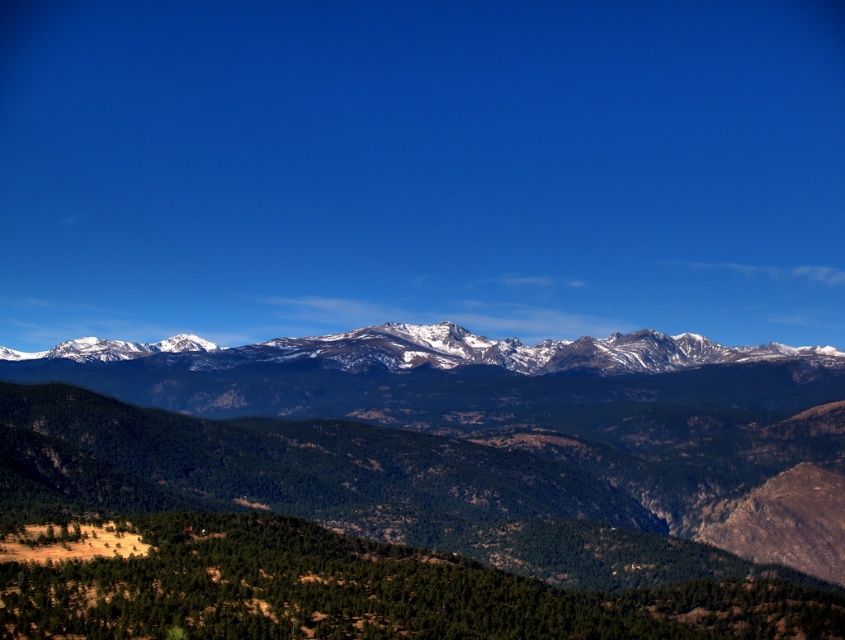
Between green textured hillside at lower center and snowy rocky mountain range at center, which one appears on the right side from the viewer's perspective?

From the viewer's perspective, green textured hillside at lower center appears more on the right side.

Is point (226, 573) in front of point (437, 342)?

That is True.

In order to click on green textured hillside at lower center in this screenshot , I will do `click(366, 593)`.